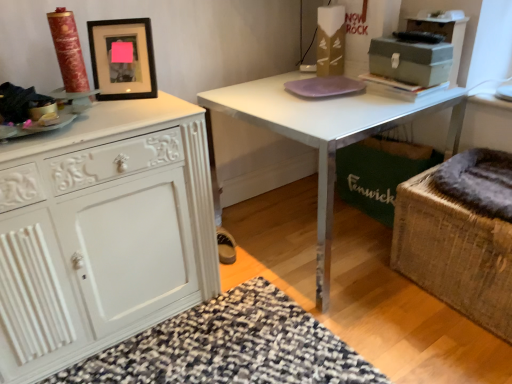
Find the location of a particular element. The height and width of the screenshot is (384, 512). blank space to the left of rattan wicker swivel chair at lower right, the 1th swivel chair when ordered from bottom to top is located at coordinates (367, 296).